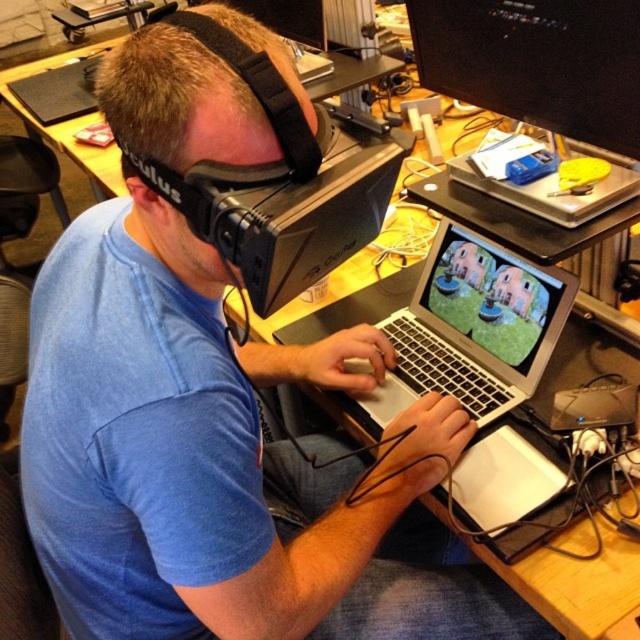
Does black glossy monitor at upper center appear on the right side of silver metallic laptop at center?

Correct, you'll find black glossy monitor at upper center to the right of silver metallic laptop at center.

Is black glossy monitor at upper center below silver metallic laptop at center?

No.

At what (x,y) coordinates should I click in order to perform the action: click on black glossy monitor at upper center. Please return your answer as a coordinate pair (x, y). Image resolution: width=640 pixels, height=640 pixels. Looking at the image, I should click on 538,61.